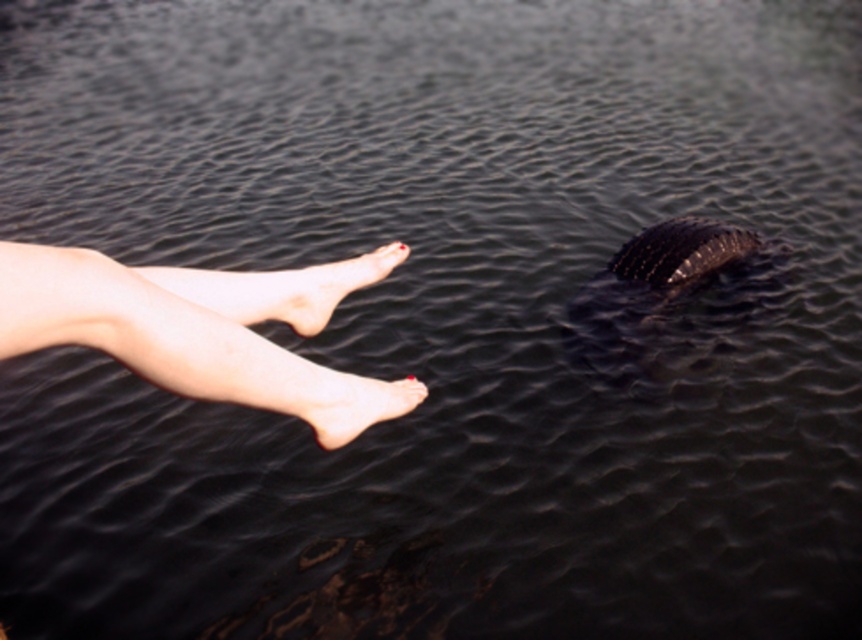
Question: Is smooth skin legs at upper left behind pale skin/soft flesh at lower left?

Choices:
 (A) yes
 (B) no

Answer: (B)

Question: Is the position of smooth skin legs at upper left more distant than that of pale skin/soft flesh at lower left?

Choices:
 (A) yes
 (B) no

Answer: (B)

Question: Can you confirm if smooth skin legs at upper left is thinner than pale skin/soft foot at lower center?

Choices:
 (A) yes
 (B) no

Answer: (B)

Question: Among these points, which one is nearest to the camera?

Choices:
 (A) (413, 397)
 (B) (260, 280)
 (C) (175, 333)

Answer: (C)

Question: Which point is farther to the camera?

Choices:
 (A) smooth skin legs at upper left
 (B) pale skin/soft foot at lower center
 (C) pale skin/soft flesh at lower left

Answer: (C)

Question: Which point is closer to the camera?

Choices:
 (A) pale skin/soft flesh at lower left
 (B) pale skin/soft foot at lower center

Answer: (B)